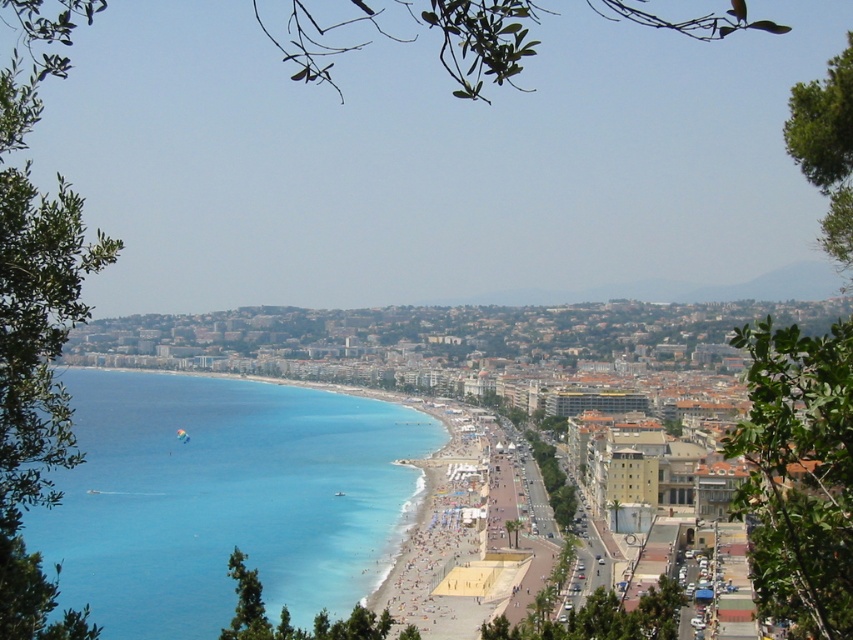
Does point (364, 593) come farther from viewer compared to point (498, 492)?

No, it is not.

Between point (375, 531) and point (492, 548), which one is positioned in front?

Positioned in front is point (492, 548).

Between point (83, 435) and point (540, 563), which one is positioned behind?

The point (83, 435) is behind.

Locate an element on the screen. This screenshot has width=853, height=640. blue clear water at lower left is located at coordinates (223, 499).